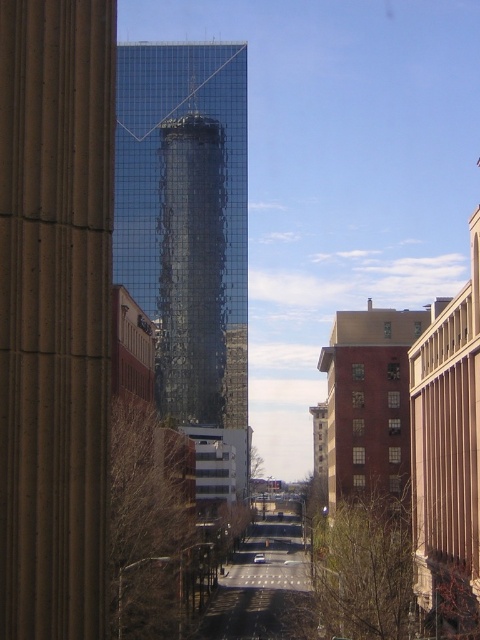
You are standing on the sidewalk and see the brown stone pillar at left and the glossy glass skyscraper at center. Which object is closer to your right side?

The brown stone pillar at left is positioned on the right side of glossy glass skyscraper at center, so it is closer to your right side.